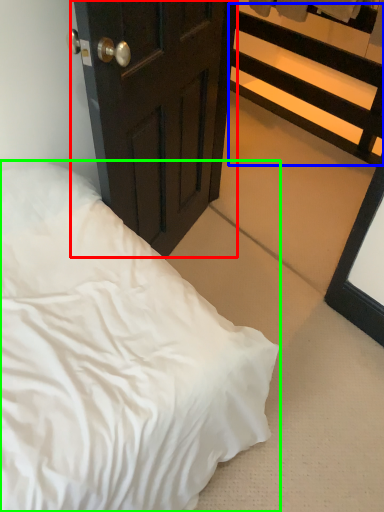
Question: Considering the real-world distances, which object is farthest from door (highlighted by a red box)? balustrade (highlighted by a blue box) or bed (highlighted by a green box)?

Choices:
 (A) balustrade
 (B) bed

Answer: (A)